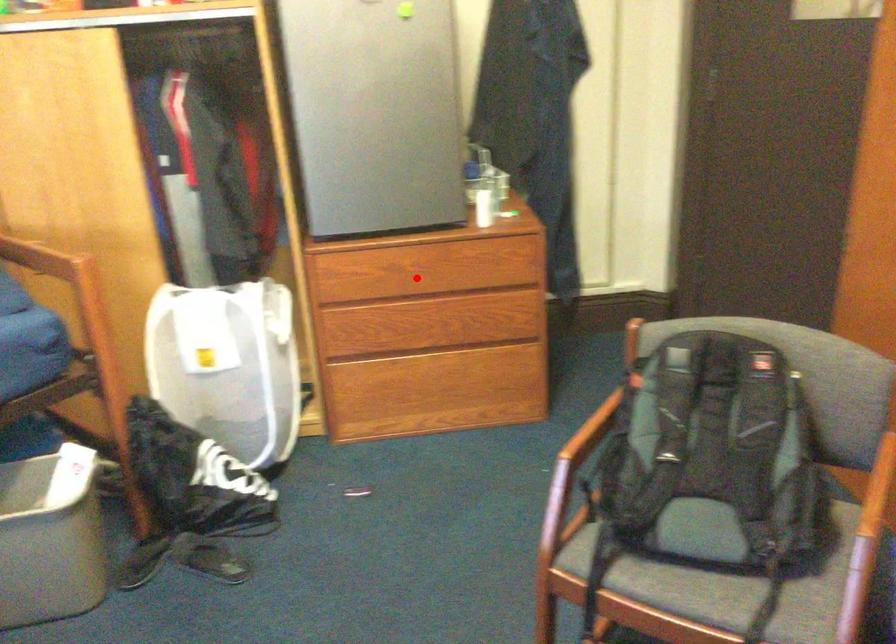
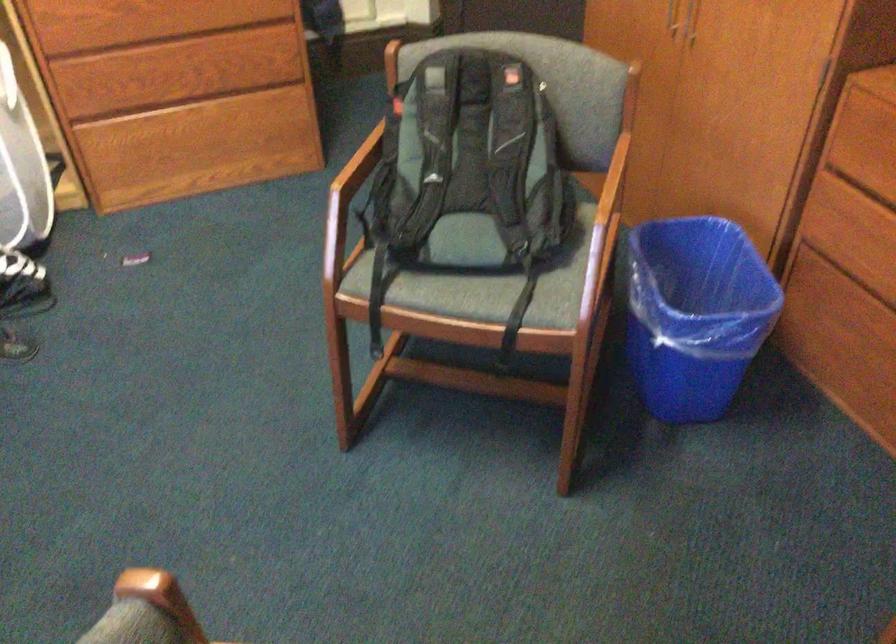
Question: I am providing you with two images of the same scene from different viewpoints. In image1, a red point is highlighted. Considering the same 3D point in image2, which of the following is correct?

Choices:
 (A) It is closer
 (B) It is farther

Answer: (A)